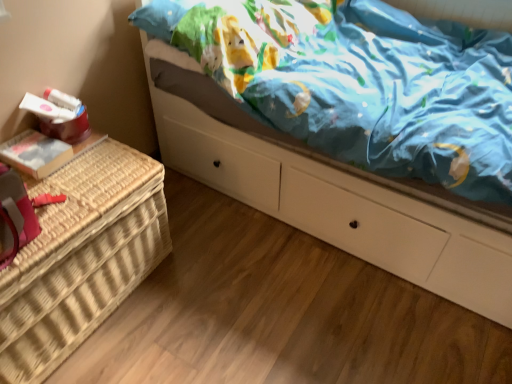
Question: Based on their sizes in the image, would you say woven wicker basket at left is bigger or smaller than white glossy bed at upper center?

Choices:
 (A) big
 (B) small

Answer: (B)

Question: Would you say woven wicker basket at left is to the left or to the right of white glossy bed at upper center in the picture?

Choices:
 (A) left
 (B) right

Answer: (A)

Question: In the image, is woven wicker basket at left positioned in front of or behind white glossy bed at upper center?

Choices:
 (A) front
 (B) behind

Answer: (B)

Question: In the image, is white glossy bed at upper center positioned in front of or behind woven wicker basket at left?

Choices:
 (A) behind
 (B) front

Answer: (B)

Question: In terms of size, does white glossy bed at upper center appear bigger or smaller than woven wicker basket at left?

Choices:
 (A) small
 (B) big

Answer: (B)

Question: In terms of height, does white glossy bed at upper center look taller or shorter compared to woven wicker basket at left?

Choices:
 (A) tall
 (B) short

Answer: (A)

Question: In terms of width, does white glossy bed at upper center look wider or thinner when compared to woven wicker basket at left?

Choices:
 (A) thin
 (B) wide

Answer: (B)